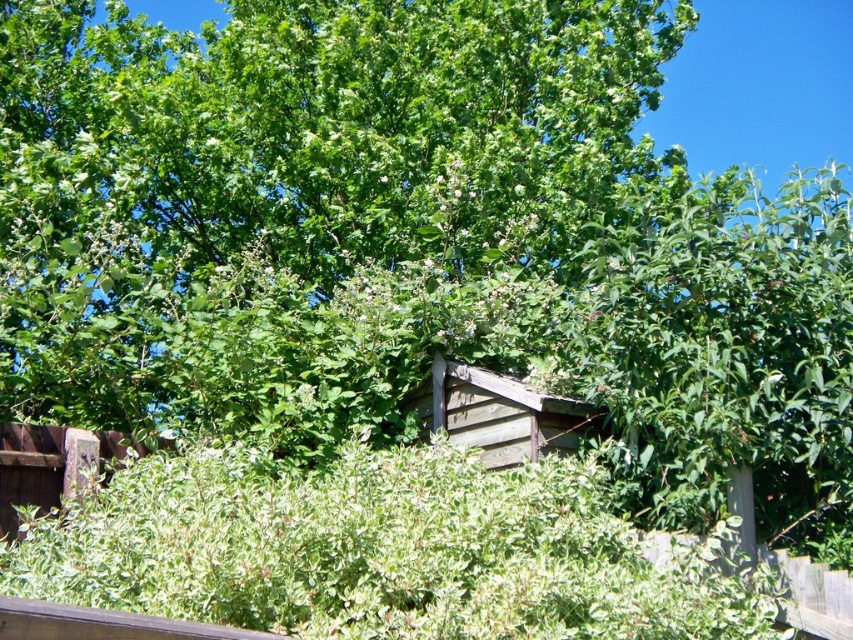
Who is lower down, green leafy tree at center or weathered wood hut at center?

Positioned lower is weathered wood hut at center.

Does green leafy tree at center have a lesser height compared to weathered wood hut at center?

Indeed, green leafy tree at center has a lesser height compared to weathered wood hut at center.

In order to click on green leafy tree at center in this screenshot , I will do `click(308, 202)`.